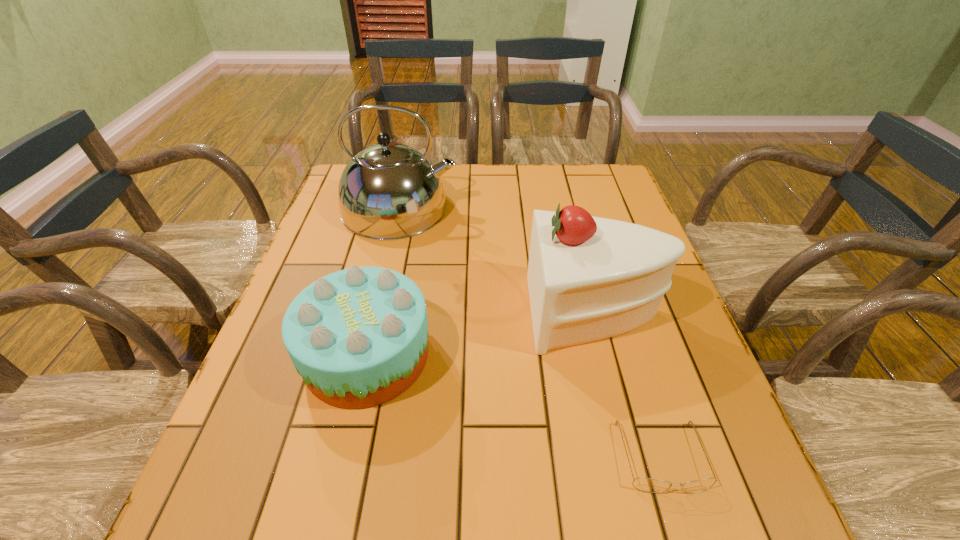
You are a GUI agent. You are given a task and a screenshot of the screen. Output one action in this format:
    pyautogui.click(x=<x>, y=<y>)
    Task: Click on the vacant area that lies between the kettle and the taller cake
    The height and width of the screenshot is (540, 960).
    Given the screenshot: What is the action you would take?
    pyautogui.click(x=497, y=260)

Identify which object is located as the third nearest to the farthest object. Please provide its 2D coordinates. Your answer should be formatted as a tuple, i.e. [(x, y)], where the tuple contains the x and y coordinates of a point satisfying the conditions above.

[(644, 484)]

Locate which object is the third closest to the spectacles. Please provide its 2D coordinates. Your answer should be formatted as a tuple, i.e. [(x, y)], where the tuple contains the x and y coordinates of a point satisfying the conditions above.

[(388, 191)]

What are the coordinates of `vacant space that satisfies the following two spatial constraints: 1. on the back side of the left cake; 2. from the spout of the kettle` in the screenshot? It's located at (400, 208).

You are a GUI agent. You are given a task and a screenshot of the screen. Output one action in this format:
    pyautogui.click(x=<x>, y=<y>)
    Task: Click on the vacant space that satisfies the following two spatial constraints: 1. from the spout of the second shortest object; 2. on the left side of the kettle
    
    Given the screenshot: What is the action you would take?
    pyautogui.click(x=365, y=355)

What are the coordinates of `free spot that satisfies the following two spatial constraints: 1. from the spout of the kettle; 2. on the right side of the right cake` in the screenshot? It's located at (375, 313).

The image size is (960, 540). Find the location of `vacant space that satisfies the following two spatial constraints: 1. from the spout of the kettle; 2. on the left side of the left cake`. vacant space that satisfies the following two spatial constraints: 1. from the spout of the kettle; 2. on the left side of the left cake is located at coordinates (365, 355).

Where is `free space that satisfies the following two spatial constraints: 1. from the spout of the left cake; 2. on the right side of the kettle`? Image resolution: width=960 pixels, height=540 pixels. free space that satisfies the following two spatial constraints: 1. from the spout of the left cake; 2. on the right side of the kettle is located at coordinates (365, 355).

The width and height of the screenshot is (960, 540). Identify the location of vacant space that satisfies the following two spatial constraints: 1. from the spout of the taller cake; 2. on the right side of the farthest object. (375, 313).

Where is `blank area in the image that satisfies the following two spatial constraints: 1. on the back side of the left cake; 2. from the spout of the farthest object`? This screenshot has width=960, height=540. blank area in the image that satisfies the following two spatial constraints: 1. on the back side of the left cake; 2. from the spout of the farthest object is located at coordinates click(x=400, y=208).